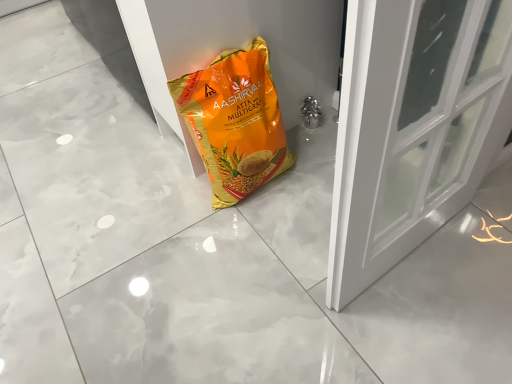
Describe the element at coordinates (413, 127) in the screenshot. I see `white glossy door at center` at that location.

Find the location of `white glossy door at center`. white glossy door at center is located at coordinates (413, 127).

What is the approximate width of white glossy door at center?

1.28 meters.

Where is `orange matte plastic bag at center`? orange matte plastic bag at center is located at coordinates (234, 122).

What do you see at coordinates (234, 122) in the screenshot? This screenshot has width=512, height=384. I see `orange matte plastic bag at center` at bounding box center [234, 122].

This screenshot has height=384, width=512. What are the coordinates of `white glossy door at center` in the screenshot? It's located at (413, 127).

Can you confirm if white glossy door at center is positioned to the right of orange matte plastic bag at center?

Yes, white glossy door at center is to the right of orange matte plastic bag at center.

Looking at this image, which is behind, white glossy door at center or orange matte plastic bag at center?

white glossy door at center is more distant.

Which is closer to the camera, (358, 232) or (216, 200)?

Positioned in front is point (358, 232).

From the image's perspective, is white glossy door at center below orange matte plastic bag at center?

Actually, white glossy door at center appears above orange matte plastic bag at center in the image.

From a real-world perspective, who is located higher, white glossy door at center or orange matte plastic bag at center?

In real-world perspective, orange matte plastic bag at center is above.

Considering the sizes of objects white glossy door at center and orange matte plastic bag at center in the image provided, who is thinner, white glossy door at center or orange matte plastic bag at center?

orange matte plastic bag at center is thinner.

Looking at this image, which of these two, white glossy door at center or orange matte plastic bag at center, stands shorter?

white glossy door at center is shorter.

Looking at the image, does white glossy door at center seem bigger or smaller compared to orange matte plastic bag at center?

In the image, white glossy door at center appears to be larger than orange matte plastic bag at center.

From the picture: Would you say white glossy door at center is inside or outside orange matte plastic bag at center?

white glossy door at center is located beyond the bounds of orange matte plastic bag at center.

Is white glossy door at center far away from orange matte plastic bag at center?

white glossy door at center is near orange matte plastic bag at center, not far away.

Is white glossy door at center aimed at orange matte plastic bag at center?

No, white glossy door at center is not turned towards orange matte plastic bag at center.

Can you tell me how much white glossy door at center and orange matte plastic bag at center differ in facing direction?

white glossy door at center and orange matte plastic bag at center are facing 1.53 degrees away from each other.

This screenshot has width=512, height=384. Identify the location of plastic bag on the left of white glossy door at center. (x=234, y=122).

Based on the photo, is orange matte plastic bag at center at the left side of white glossy door at center?

Yes.

Which is behind, orange matte plastic bag at center or white glossy door at center?

white glossy door at center is more distant.

Which point is more forward, (240,126) or (408,84)?

The point (408,84) is in front.

From the image's perspective, is orange matte plastic bag at center below white glossy door at center?

Indeed, from the image's perspective, orange matte plastic bag at center is shown beneath white glossy door at center.

From a real-world perspective, does orange matte plastic bag at center sit lower than white glossy door at center?

No.

Which of these two, orange matte plastic bag at center or white glossy door at center, is thinner?

orange matte plastic bag at center is thinner.

Does orange matte plastic bag at center have a lesser height compared to white glossy door at center?

Incorrect, the height of orange matte plastic bag at center does not fall short of that of white glossy door at center.

In terms of size, does orange matte plastic bag at center appear bigger or smaller than white glossy door at center?

In the image, orange matte plastic bag at center appears to be smaller than white glossy door at center.

Is white glossy door at center surrounded by orange matte plastic bag at center?

Actually, white glossy door at center is outside orange matte plastic bag at center.

Is orange matte plastic bag at center with white glossy door at center?

orange matte plastic bag at center and white glossy door at center are not in contact.

Is orange matte plastic bag at center facing away from white glossy door at center?

Absolutely, orange matte plastic bag at center is directed away from white glossy door at center.

How distant is orange matte plastic bag at center from white glossy door at center?

orange matte plastic bag at center and white glossy door at center are 53.51 centimeters apart from each other.

Find the location of a particular element. This screenshot has width=512, height=384. plastic bag that is on the left side of white glossy door at center is located at coordinates (234, 122).

At what (x,y) coordinates should I click in order to perform the action: click on plastic bag in front of the white glossy door at center. Please return your answer as a coordinate pair (x, y). The height and width of the screenshot is (384, 512). Looking at the image, I should click on (234, 122).

What are the coordinates of `door on the right of orange matte plastic bag at center` in the screenshot? It's located at (413, 127).